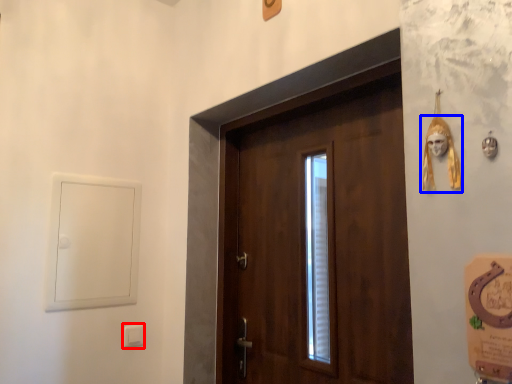
Question: Which object is further to the camera taking this photo, light switch (highlighted by a red box) or skull (highlighted by a blue box)?

Choices:
 (A) light switch
 (B) skull

Answer: (A)